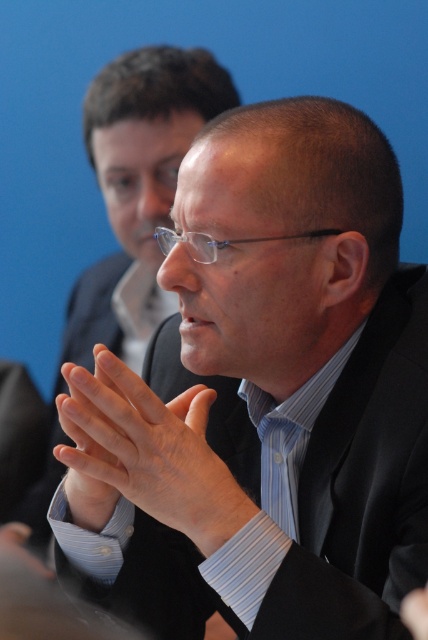
Question: Can you confirm if matte black suit at center is bigger than smooth skin hands at center?

Choices:
 (A) no
 (B) yes

Answer: (B)

Question: Which of the following is the farthest from the observer?

Choices:
 (A) (184, 464)
 (B) (98, 273)
 (C) (160, 316)

Answer: (B)

Question: Does smooth skin hands at center have a greater width compared to black matte suit at center?

Choices:
 (A) no
 (B) yes

Answer: (A)

Question: Which of these objects is positioned closest to the matte black suit at center?

Choices:
 (A) black matte suit at center
 (B) smooth skin hands at center

Answer: (A)

Question: Can you confirm if smooth skin hands at center is positioned to the left of black matte suit at center?

Choices:
 (A) yes
 (B) no

Answer: (B)

Question: Among these objects, which one is farthest from the camera?

Choices:
 (A) matte black suit at center
 (B) smooth skin hands at center
 (C) black matte suit at center

Answer: (C)